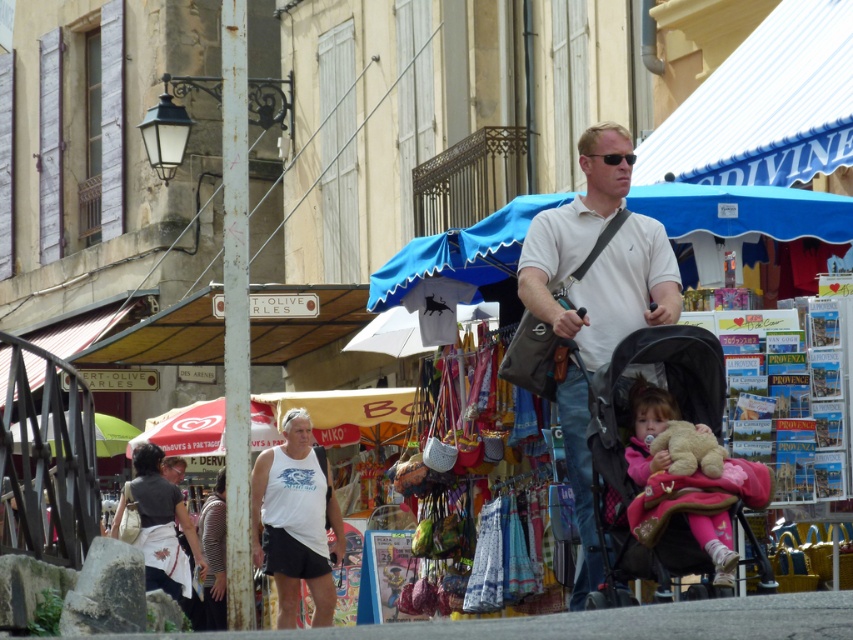
In the market scene, there are two items of clothing visible. The first is a white matte tank top at center, and the second is a pink fleece jacket at lower right. From the perspective of someone standing in the middle of the market, which clothing item is closer to the ground?

The white matte tank top at center is positioned under the pink fleece jacket at lower right, so it is closer to the ground.